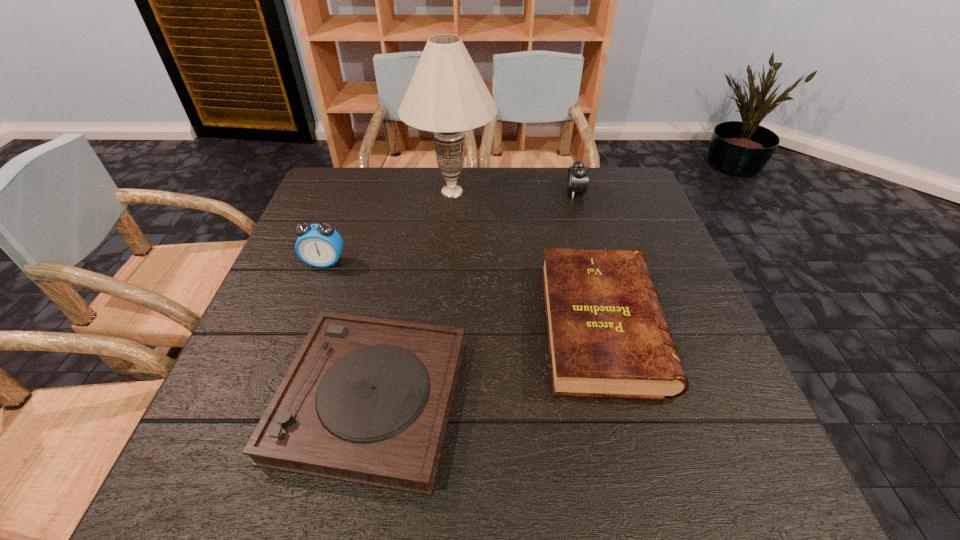
This screenshot has height=540, width=960. Find the location of `empty space between the hardback book and the lampshade`. empty space between the hardback book and the lampshade is located at coordinates (527, 259).

Identify the location of free space between the tallest object and the farther alarm clock. (514, 192).

Locate an element on the screen. free space between the lampshade and the shortest object is located at coordinates (412, 295).

Where is `vacant space in between the farther alarm clock and the lampshade`? This screenshot has width=960, height=540. vacant space in between the farther alarm clock and the lampshade is located at coordinates (514, 192).

Locate which object is the closest to the third shortest object. Please provide its 2D coordinates. Your answer should be formatted as a tuple, i.e. [(x, y)], where the tuple contains the x and y coordinates of a point satisfying the conditions above.

[(446, 95)]

Where is `object that stands as the third closest to the hardback book`? This screenshot has height=540, width=960. object that stands as the third closest to the hardback book is located at coordinates (577, 181).

Image resolution: width=960 pixels, height=540 pixels. In order to click on vacant space that satisfies the following two spatial constraints: 1. on the face of the phonograph record; 2. on the left side of the third nearest object in this screenshot , I will do `click(274, 399)`.

This screenshot has width=960, height=540. Find the location of `vacant area in the image that satisfies the following two spatial constraints: 1. on the back side of the shortest object; 2. on the right side of the lampshade`. vacant area in the image that satisfies the following two spatial constraints: 1. on the back side of the shortest object; 2. on the right side of the lampshade is located at coordinates (412, 192).

Image resolution: width=960 pixels, height=540 pixels. Identify the location of free space that satisfies the following two spatial constraints: 1. on the face of the shortest object; 2. on the right side of the left alarm clock. (274, 399).

In order to click on free point that satisfies the following two spatial constraints: 1. on the face of the hardback book; 2. on the left side of the nearer alarm clock in this screenshot , I will do `click(300, 326)`.